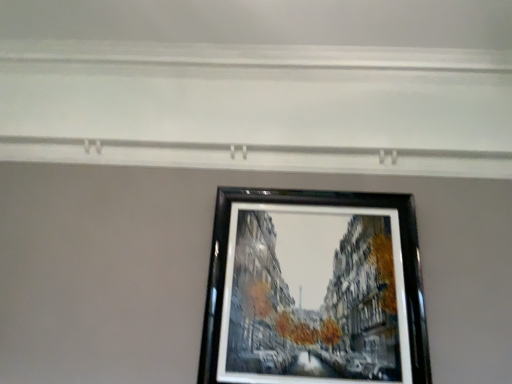
Describe the element at coordinates (314, 290) in the screenshot. I see `black glossy picture frame at center` at that location.

Where is `black glossy picture frame at center`? The width and height of the screenshot is (512, 384). black glossy picture frame at center is located at coordinates (314, 290).

What is the approximate width of black glossy picture frame at center?

black glossy picture frame at center is 3.09 inches wide.

At what (x,y) coordinates should I click in order to perform the action: click on black glossy picture frame at center. Please return your answer as a coordinate pair (x, y). Image resolution: width=512 pixels, height=384 pixels. Looking at the image, I should click on (314, 290).